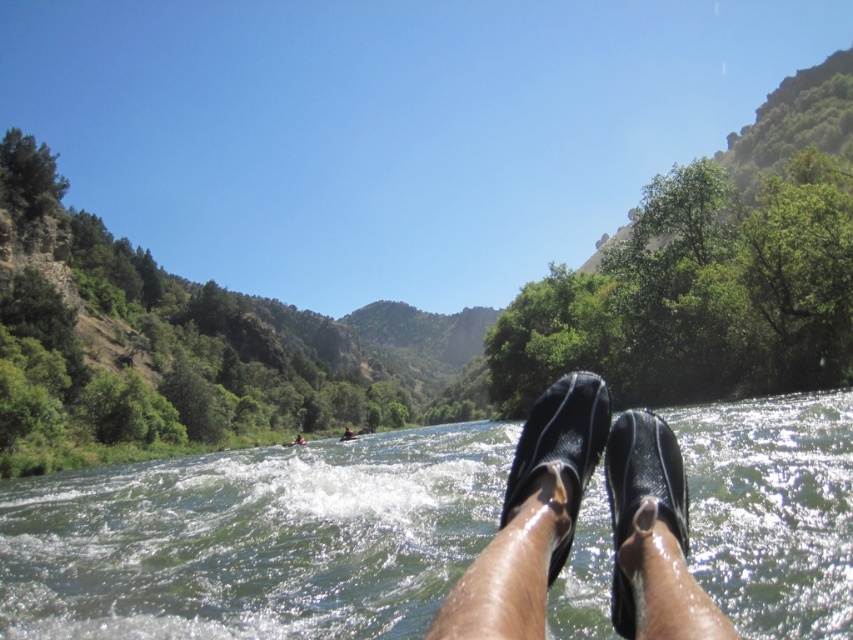
Question: Does black rubber flip-flop at lower center lie behind brown leather kayak at center?

Choices:
 (A) no
 (B) yes

Answer: (A)

Question: Which point is closer to the camera?

Choices:
 (A) black rubber flip-flop at lower center
 (B) black rubber sandals at center

Answer: (B)

Question: Considering the real-world distances, which object is farthest from the green rubber boots at lower center?

Choices:
 (A) black mesh sandal at lower center
 (B) black rubber sandals at center

Answer: (B)

Question: Among these objects, which one is farthest from the camera?

Choices:
 (A) black rubber flip-flop at lower center
 (B) black mesh sandal at lower center
 (C) black rubber sandals at center
 (D) green rubber boots at lower center

Answer: (B)

Question: Is green rubber boots at lower center below black rubber sandals at center?

Choices:
 (A) yes
 (B) no

Answer: (A)

Question: Can you confirm if green rubber boots at lower center is smaller than black mesh sandal at lower center?

Choices:
 (A) yes
 (B) no

Answer: (B)